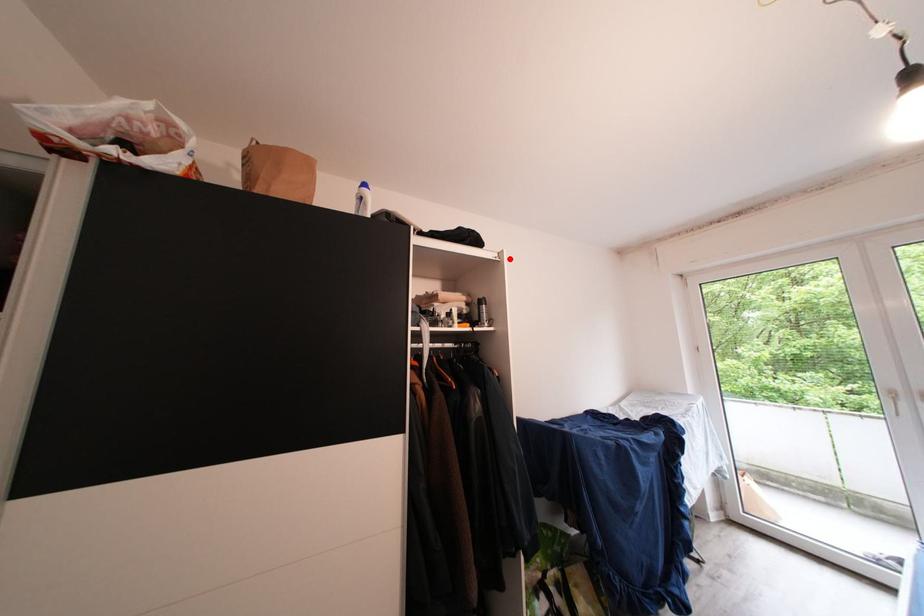
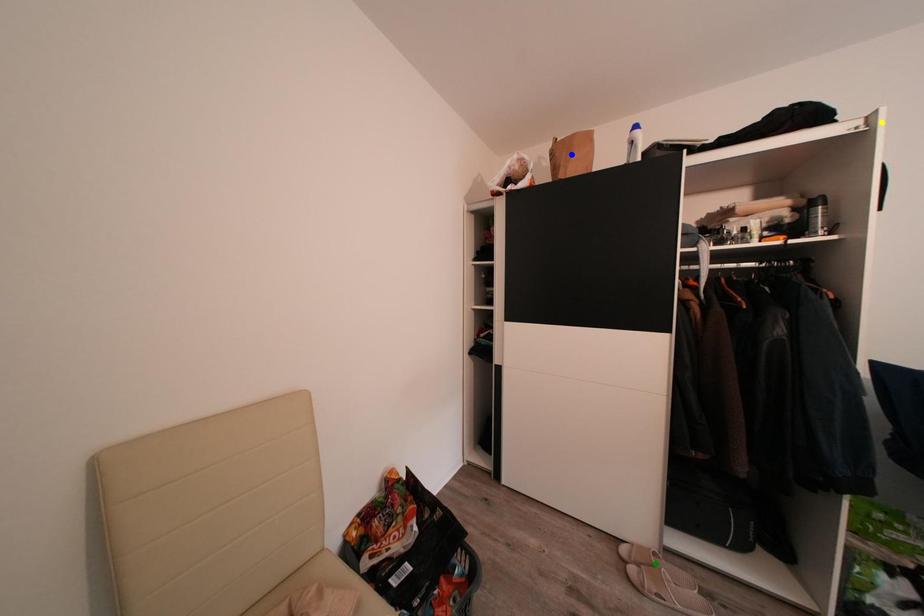
Question: I am providing you with two images of the same scene from different viewpoints. A red point is marked on the first image. You are given multiple points on the second image. Which point in image 2 is actually the same real-world point as the red point in image 1?

Choices:
 (A) green point
 (B) blue point
 (C) yellow point

Answer: (C)